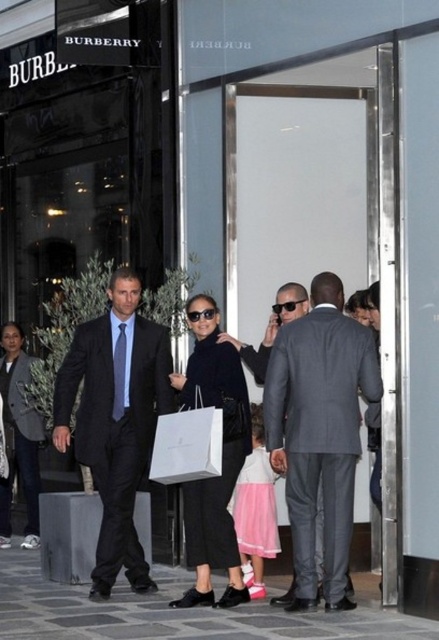
Is point (71, 358) positioned in front of point (6, 406)?

That is True.

Does dark blue suit at center appear over dark gray textured suit at left?

Indeed, dark blue suit at center is positioned over dark gray textured suit at left.

In order to click on dark blue suit at center in this screenshot , I will do `click(115, 422)`.

Does pink satin dress at center have a greater height compared to dark gray textured suit at left?

No, pink satin dress at center is not taller than dark gray textured suit at left.

How distant is pink satin dress at center from dark gray textured suit at left?

pink satin dress at center and dark gray textured suit at left are 9.68 feet apart.

I want to click on pink satin dress at center, so click(x=255, y=509).

This screenshot has height=640, width=439. Identify the location of pink satin dress at center. (255, 509).

Who is positioned more to the right, dark blue suit at center or matte black tie at left?

Positioned to the right is matte black tie at left.

Who is higher up, dark blue suit at center or matte black tie at left?

matte black tie at left

In order to click on dark blue suit at center in this screenshot , I will do `click(115, 422)`.